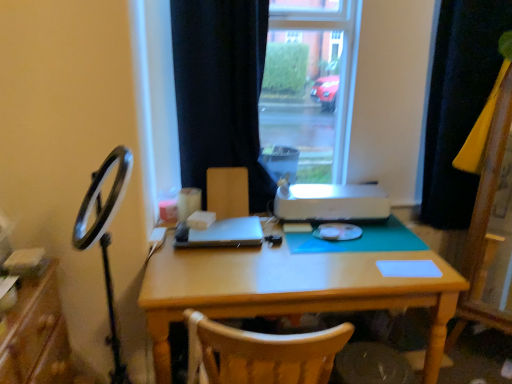
Question: Is wooden desk at center at the right side of satin black laptop at center?

Choices:
 (A) no
 (B) yes

Answer: (B)

Question: Is wooden desk at center outside satin black laptop at center?

Choices:
 (A) no
 (B) yes

Answer: (B)

Question: Is wooden desk at center taller than satin black laptop at center?

Choices:
 (A) yes
 (B) no

Answer: (A)

Question: From a real-world perspective, is wooden desk at center on top of satin black laptop at center?

Choices:
 (A) no
 (B) yes

Answer: (A)

Question: Is wooden desk at center thinner than satin black laptop at center?

Choices:
 (A) no
 (B) yes

Answer: (A)

Question: Is wooden desk at center behind satin black laptop at center?

Choices:
 (A) yes
 (B) no

Answer: (B)

Question: Can you confirm if satin black laptop at center is positioned to the right of white matte notepad at center?

Choices:
 (A) yes
 (B) no

Answer: (B)

Question: Considering the relative sizes of satin black laptop at center and white matte notepad at center in the image provided, is satin black laptop at center wider than white matte notepad at center?

Choices:
 (A) yes
 (B) no

Answer: (A)

Question: Could white matte notepad at center be considered to be inside satin black laptop at center?

Choices:
 (A) yes
 (B) no

Answer: (B)

Question: From the image's perspective, is satin black laptop at center under white matte notepad at center?

Choices:
 (A) yes
 (B) no

Answer: (B)

Question: From a real-world perspective, is satin black laptop at center below white matte notepad at center?

Choices:
 (A) no
 (B) yes

Answer: (A)

Question: Would you say satin black laptop at center is outside white matte notepad at center?

Choices:
 (A) no
 (B) yes

Answer: (B)

Question: From a real-world perspective, does wooden desk at center stand above black fabric curtain at center, which is the 2th curtain in right-to-left order?

Choices:
 (A) yes
 (B) no

Answer: (B)